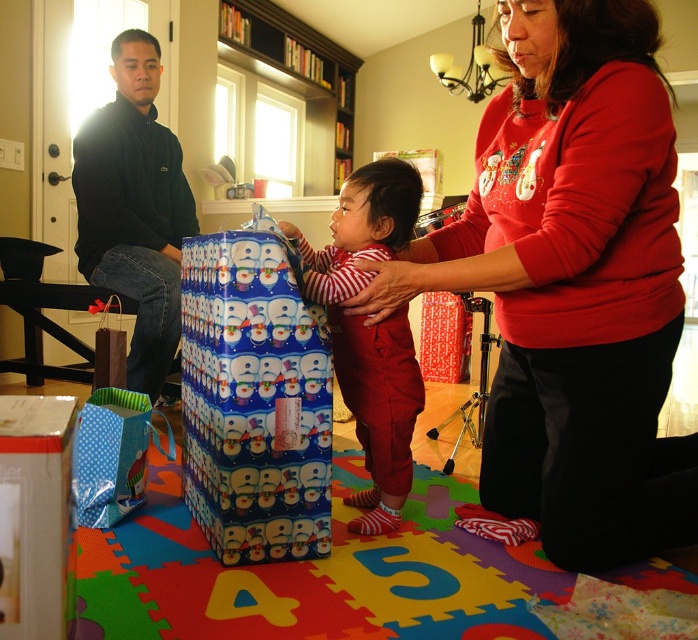
You are helping organize the gifts in the living room. You have a striped cotton onesie at center and a white cardboard box at lower left. Which object is wider?

The striped cotton onesie at center is wider than the white cardboard box at lower left.

You are a parent looking for the striped cotton onesie at center and the white cardboard box at lower left in your living room. Which object is located to the right of the other?

The striped cotton onesie at center is positioned on the right side of white cardboard box at lower left.